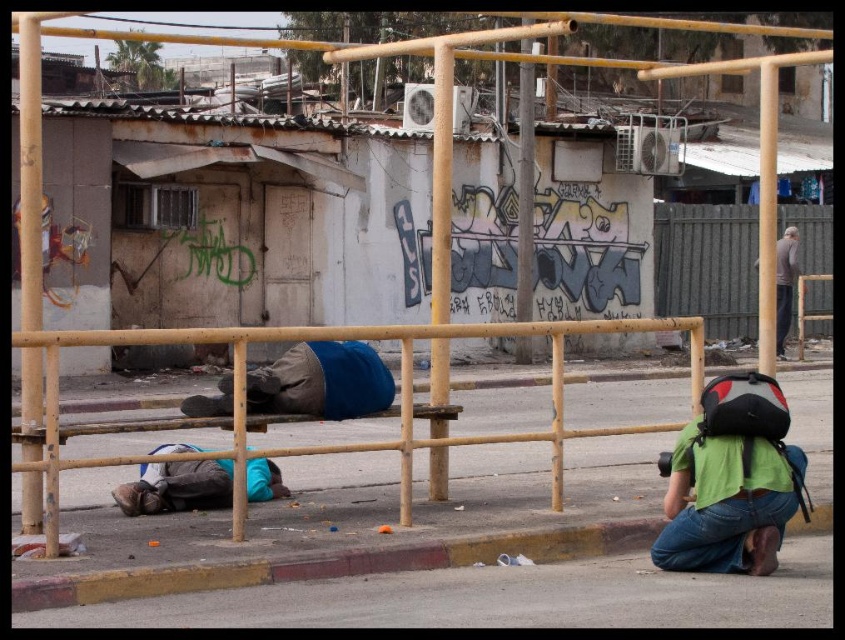
You are a delivery person who needs to place a small package between the green fabric backpack at lower right and the blue fabric at center. Considering their widths, which object should you place the package next to to ensure it fits?

The blue fabric at center has a greater width than the green fabric backpack at lower right, so placing the package next to the blue fabric at center would provide more space for it to fit.